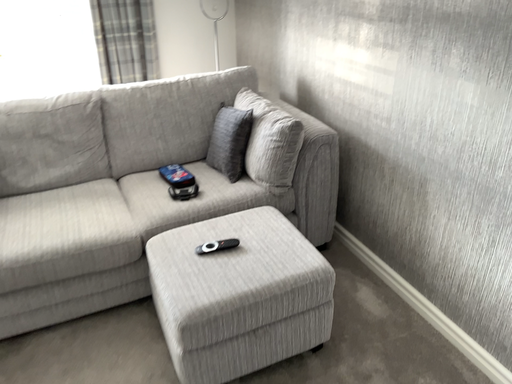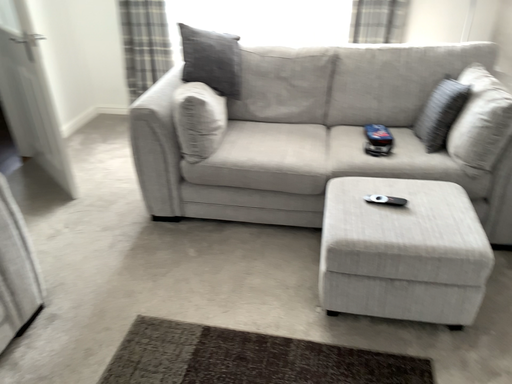
Question: Which way did the camera rotate in the video?

Choices:
 (A) rotated left
 (B) rotated right

Answer: (A)